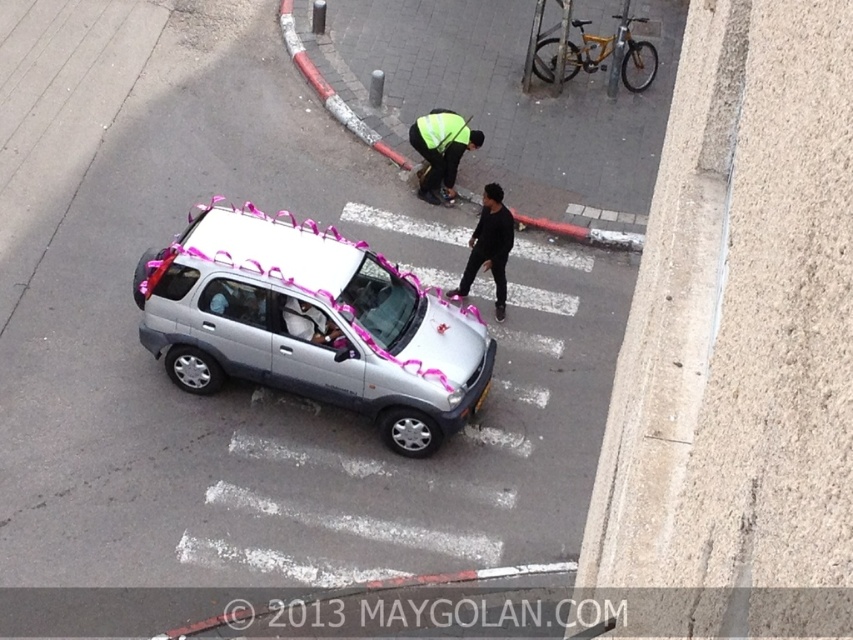
You are standing at the point closest to the SUV in the image. Which of the two points, point (573, 42) or point (469, 131), is farther away from you?

Point (573, 42) is behind point (469, 131), so it is farther away from you.